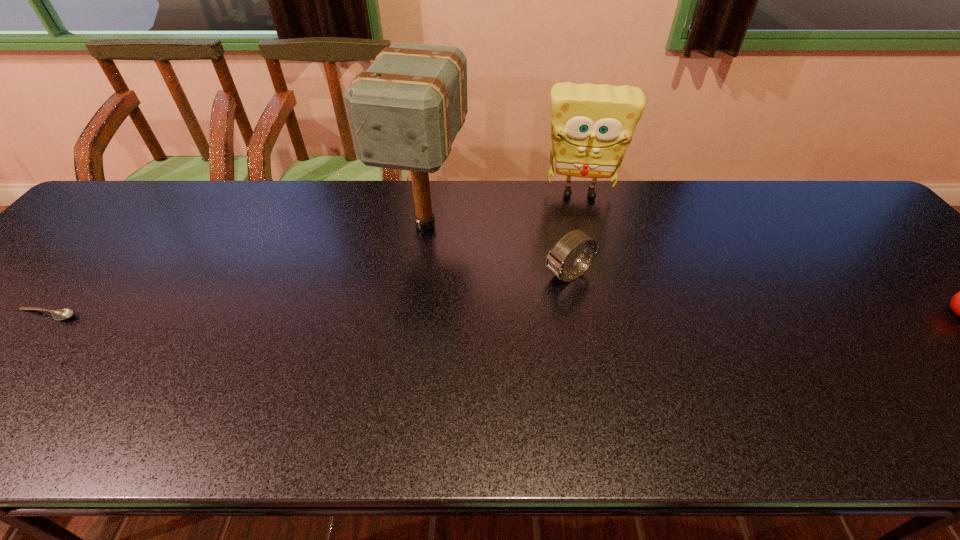
Locate an element on the screen. The image size is (960, 540). free space on the desktop that is between the shortest object and the rightmost object and is positioned on the striking surface of the tallest object is located at coordinates (386, 314).

Image resolution: width=960 pixels, height=540 pixels. I want to click on vacant spot on the desktop that is between the leftmost object and the cherry and is positioned on the face of the watch, so click(494, 314).

Find the location of a particular element. The height and width of the screenshot is (540, 960). free space on the desktop that is between the leftmost object and the cherry and is positioned on the face of the sponge is located at coordinates (584, 314).